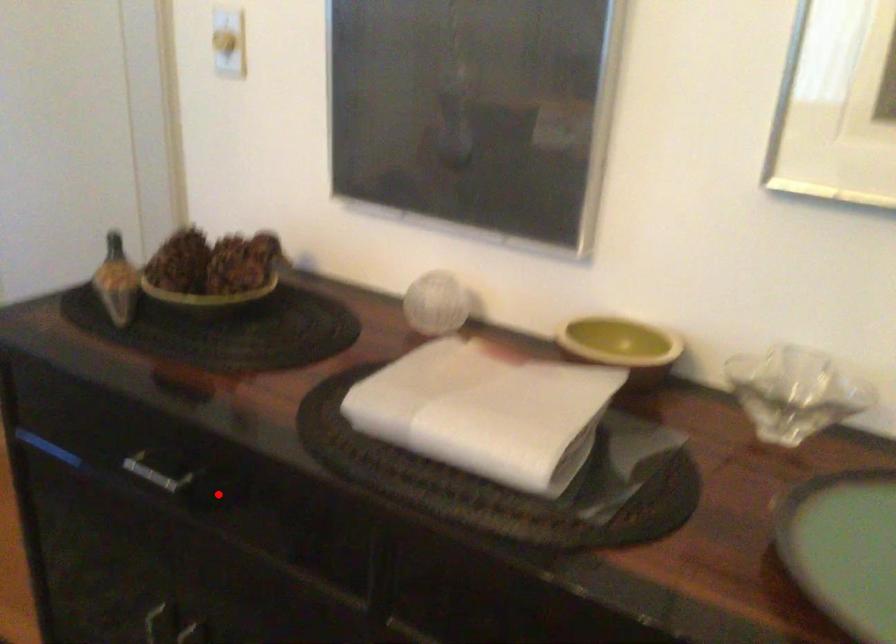
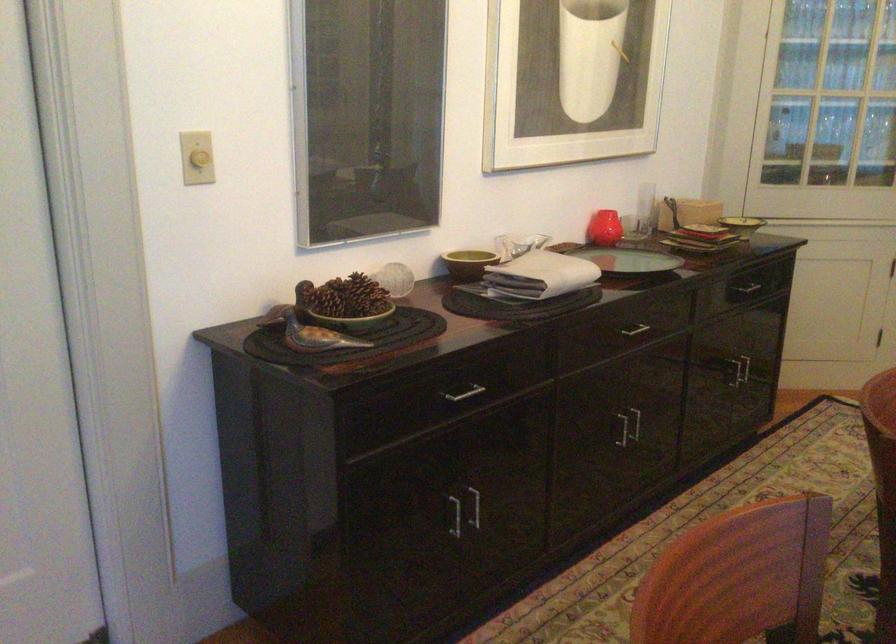
Locate, in the second image, the point that corresponds to the highlighted location in the first image.

(462, 393)